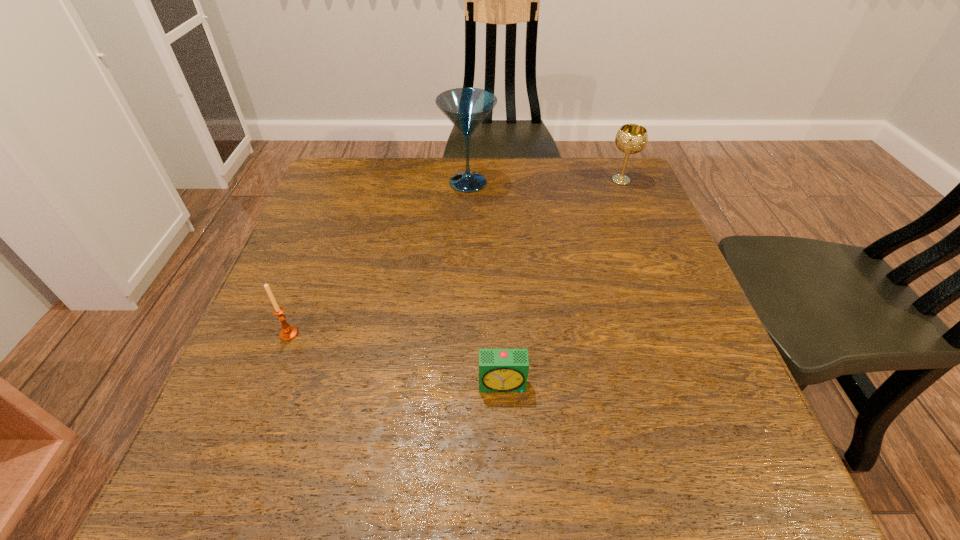
The width and height of the screenshot is (960, 540). I want to click on martini situated at the far edge, so [x=466, y=108].

Where is `chalice that is at the far edge`? The width and height of the screenshot is (960, 540). chalice that is at the far edge is located at coordinates (631, 138).

At what (x,y) coordinates should I click in order to perform the action: click on object that is at the left edge. Please return your answer as a coordinate pair (x, y). Looking at the image, I should click on (288, 332).

Identify the location of object that is positioned at the right edge. (631, 138).

Locate an element on the screen. object that is at the far right corner is located at coordinates (631, 138).

At what (x,y) coordinates should I click in order to perform the action: click on vacant space at the far edge of the desktop. Please return your answer as a coordinate pair (x, y). The height and width of the screenshot is (540, 960). Looking at the image, I should click on (498, 170).

Identify the location of vacant space at the near edge of the desktop. (469, 461).

Identify the location of vacant space at the left edge. (350, 212).

Identify the location of free space at the right edge of the desktop. The width and height of the screenshot is (960, 540). (670, 424).

I want to click on free point at the far left corner, so [x=327, y=163].